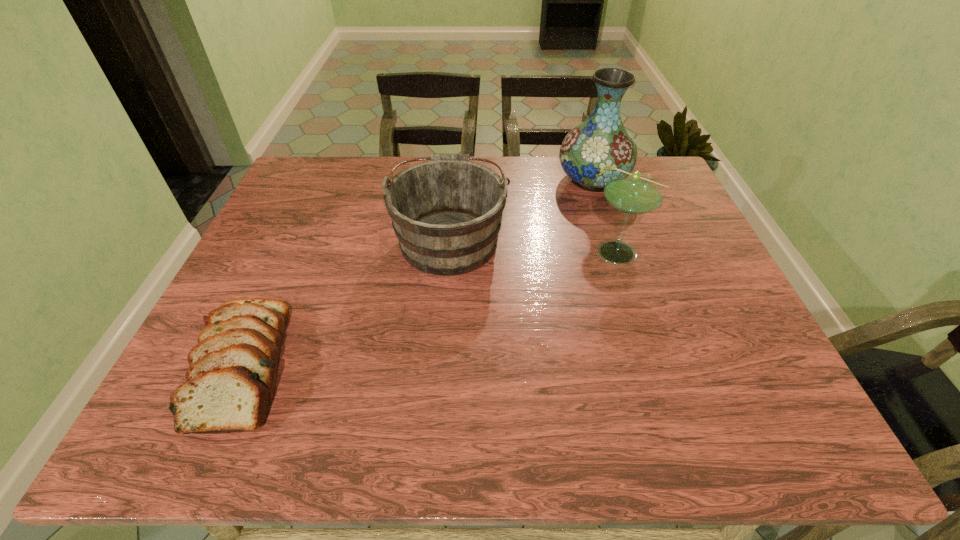
You are a GUI agent. You are given a task and a screenshot of the screen. Output one action in this format:
    pyautogui.click(x=<x>, y=<y>)
    Task: Click on the object that is at the far edge
    This screenshot has height=540, width=960.
    Given the screenshot: What is the action you would take?
    pyautogui.click(x=590, y=152)

In order to click on object that is at the near edge in this screenshot , I will do `click(230, 386)`.

At what (x,y) coordinates should I click in order to perform the action: click on object that is at the left edge. Please return your answer as a coordinate pair (x, y). Looking at the image, I should click on (230, 386).

I want to click on vase present at the right edge, so click(x=590, y=152).

At what (x,y) coordinates should I click in order to perform the action: click on martini located at the right edge. Please return your answer as a coordinate pair (x, y). Looking at the image, I should click on (631, 192).

At what (x,y) coordinates should I click in order to perform the action: click on object that is at the near left corner. Please return your answer as a coordinate pair (x, y). The image size is (960, 540). Looking at the image, I should click on (230, 386).

Where is `object positioned at the far right corner`? This screenshot has height=540, width=960. object positioned at the far right corner is located at coordinates (590, 152).

You are a GUI agent. You are given a task and a screenshot of the screen. Output one action in this format:
    pyautogui.click(x=<x>, y=<y>)
    Task: Click on the vacant space at the far edge
    The height and width of the screenshot is (540, 960).
    Given the screenshot: What is the action you would take?
    coord(524,195)

Image resolution: width=960 pixels, height=540 pixels. Find the location of `vacant area at the near edge`. vacant area at the near edge is located at coordinates click(x=322, y=438).

Where is `blank area at the left edge`? The width and height of the screenshot is (960, 540). blank area at the left edge is located at coordinates (281, 242).